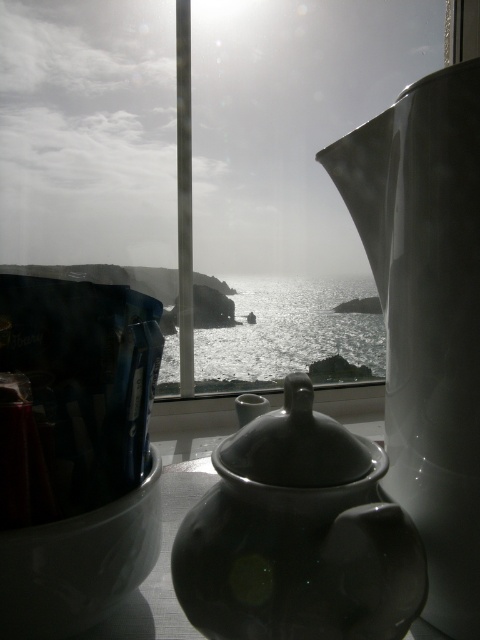
Question: Is transparent glass window at center above matte black teapot at center?

Choices:
 (A) yes
 (B) no

Answer: (A)

Question: Among these points, which one is nearest to the camera?

Choices:
 (A) (264, 472)
 (B) (412, 497)

Answer: (A)

Question: Which object appears farthest from the camera in this image?

Choices:
 (A) transparent glass window at center
 (B) glistening silver water at center
 (C) matte black teapot at center
 (D) white glossy teapot at right

Answer: (B)

Question: Does white glossy teapot at right have a smaller size compared to glistening silver water at center?

Choices:
 (A) no
 (B) yes

Answer: (B)

Question: Which point is farther from the camera taking this photo?

Choices:
 (A) (407, 432)
 (B) (242, 161)
 (C) (336, 346)

Answer: (C)

Question: Does transparent glass window at center have a lesser width compared to glistening silver water at center?

Choices:
 (A) yes
 (B) no

Answer: (B)